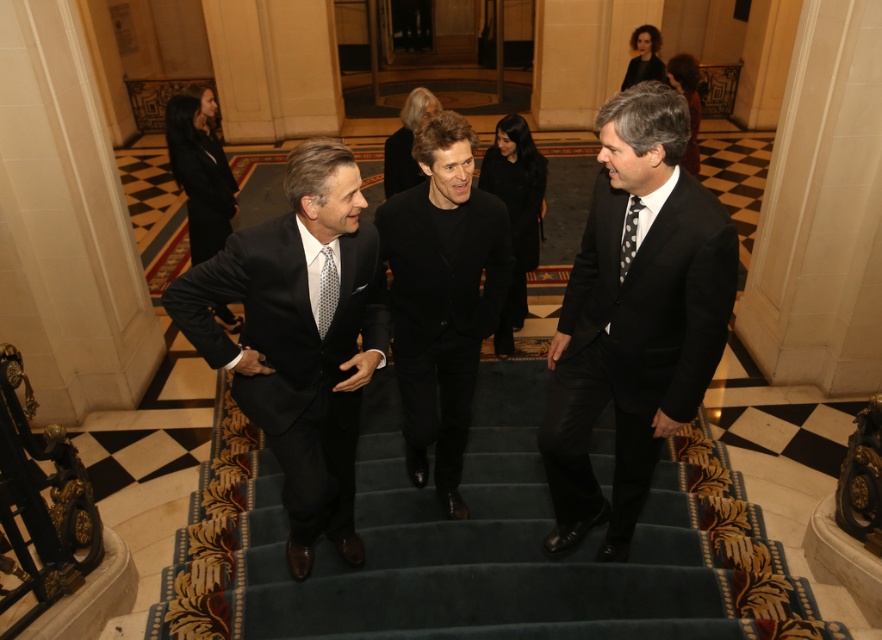
Between black satin suit at center and black wool suit at center, which one appears on the left side from the viewer's perspective?

black satin suit at center

Between black satin suit at center and black wool suit at center, which one is positioned lower?

black satin suit at center

Identify the location of black satin suit at center. click(299, 339).

Who is more forward, (x=430, y=198) or (x=330, y=321)?

Point (x=330, y=321) is more forward.

Is point (434, 397) closer to camera compared to point (320, 300)?

That is False.

Image resolution: width=882 pixels, height=640 pixels. What do you see at coordinates (442, 296) in the screenshot?
I see `black wool suit at center` at bounding box center [442, 296].

The width and height of the screenshot is (882, 640). What are the coordinates of `black wool suit at center` in the screenshot? It's located at (442, 296).

Who is more distant from viewer, (446,516) or (624,260)?

The point (446,516) is behind.

Is the position of black wool suit at center less distant than that of black dotted tie at center?

No, black wool suit at center is further to the viewer.

Between point (452, 266) and point (626, 243), which one is positioned behind?

The point (452, 266) is more distant.

What are the coordinates of `black wool suit at center` in the screenshot? It's located at (442, 296).